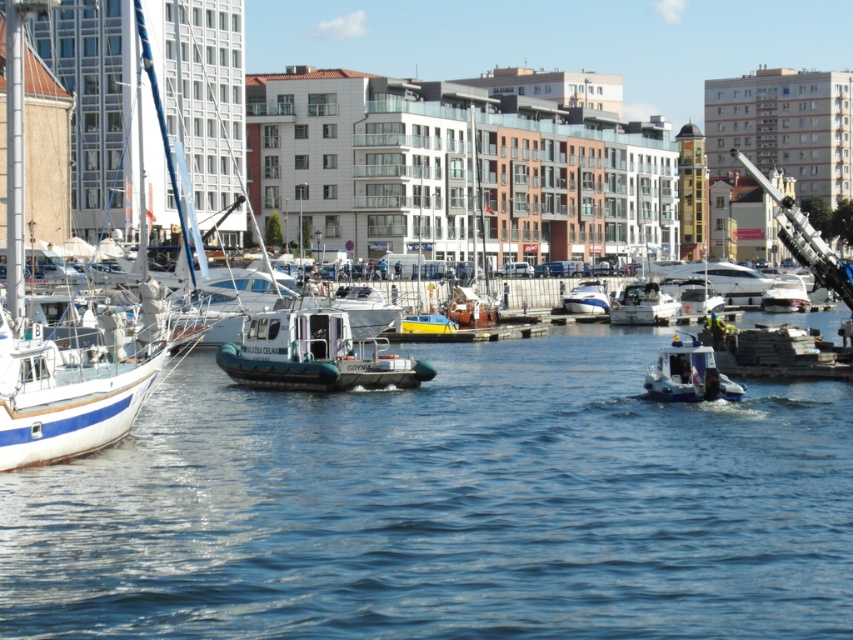
You are standing at the edge of the pier looking out at the waterfront scene. There are two points marked on the image, one at coordinates point (326, 385) and the other at point (602, 294). Which point is nearer to you?

Point (326, 385) is closer to the viewer than point (602, 294).

You are standing at the edge of the waterfront and want to locate two points marked in the image. The first point is at coordinates point (659,380) and the second is at point (598,298). Which point is closer to you?

Point (659,380) is in front of point (598,298), so the first point is closer to you.

You are a dock worker who needs to secure both the green rubber boat at center and the white glossy speedboat at center. Which boat should you secure first to prevent them from colliding if the water level rises?

The green rubber boat at center should be secured first because it is positioned under the white glossy speedboat at center, so rising water could cause it to float upward and collide with the speedboat.